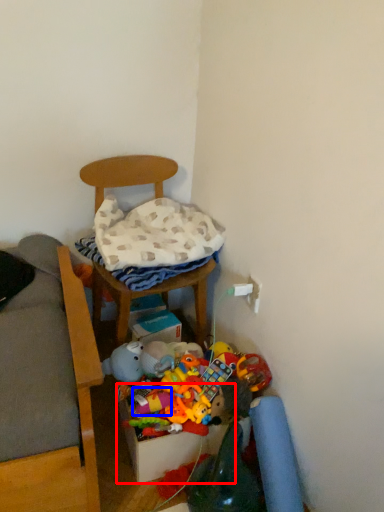
Question: Which point is further to the camera, storage box (highlighted by a red box) or toy (highlighted by a blue box)?

Choices:
 (A) storage box
 (B) toy

Answer: (B)